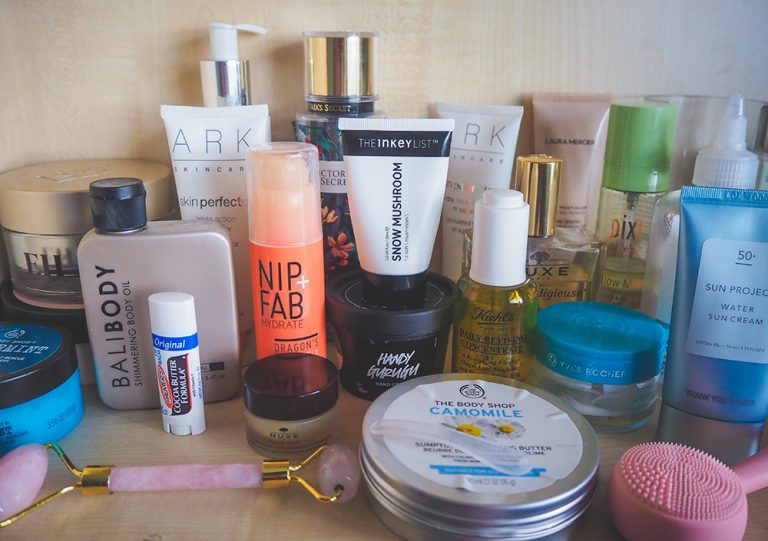
Locate an element on the screen. This screenshot has width=768, height=541. bottles white is located at coordinates [226, 149], [392, 194], [500, 128], [505, 242], [723, 164].